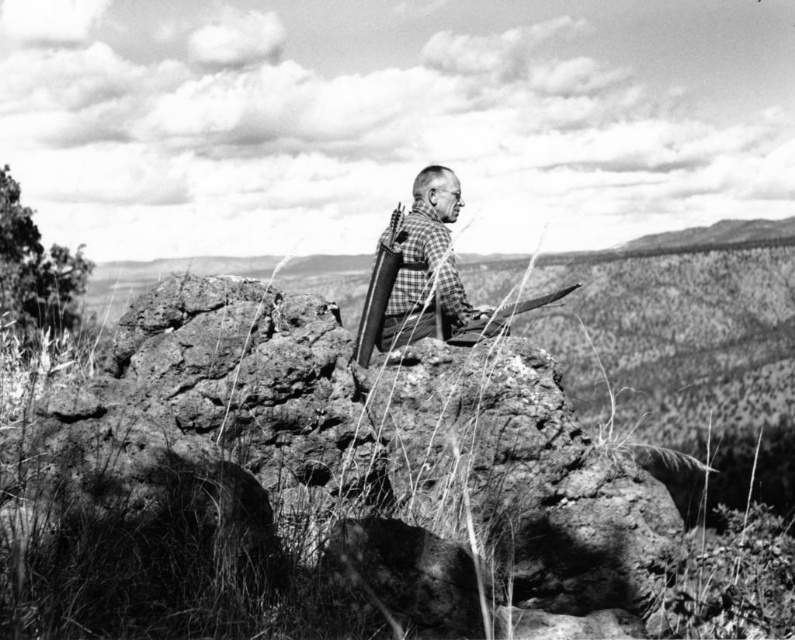
Is checkered fabric shirt at center positioned at the back of polished metal rifle at center?

Yes, it is.

From the picture: Can you confirm if checkered fabric shirt at center is thinner than polished metal rifle at center?

In fact, checkered fabric shirt at center might be wider than polished metal rifle at center.

The image size is (795, 640). Describe the element at coordinates (429, 268) in the screenshot. I see `checkered fabric shirt at center` at that location.

Where is `checkered fabric shirt at center`? checkered fabric shirt at center is located at coordinates (429, 268).

Is rough textured rock at center to the right of checkered fabric shirt at center from the viewer's perspective?

In fact, rough textured rock at center is to the left of checkered fabric shirt at center.

Is the position of rough textured rock at center less distant than that of checkered fabric shirt at center?

Yes.

This screenshot has width=795, height=640. Find the location of `rough textured rock at center`. rough textured rock at center is located at coordinates (324, 481).

Identify the location of rough textured rock at center. This screenshot has height=640, width=795. (324, 481).

Is the position of rough textured rock at center more distant than that of polished metal rifle at center?

No.

Who is positioned more to the right, rough textured rock at center or polished metal rifle at center?

From the viewer's perspective, rough textured rock at center appears more on the right side.

Where is `rough textured rock at center`? rough textured rock at center is located at coordinates (324, 481).

Image resolution: width=795 pixels, height=640 pixels. In order to click on rough textured rock at center in this screenshot , I will do `click(324, 481)`.